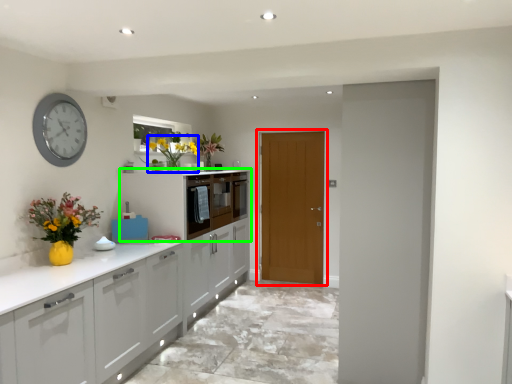
Question: Which object is the farthest from door (highlighted by a red box)? Choose among these: floral arrangement (highlighted by a blue box) or cabinetry (highlighted by a green box).

Choices:
 (A) floral arrangement
 (B) cabinetry

Answer: (A)